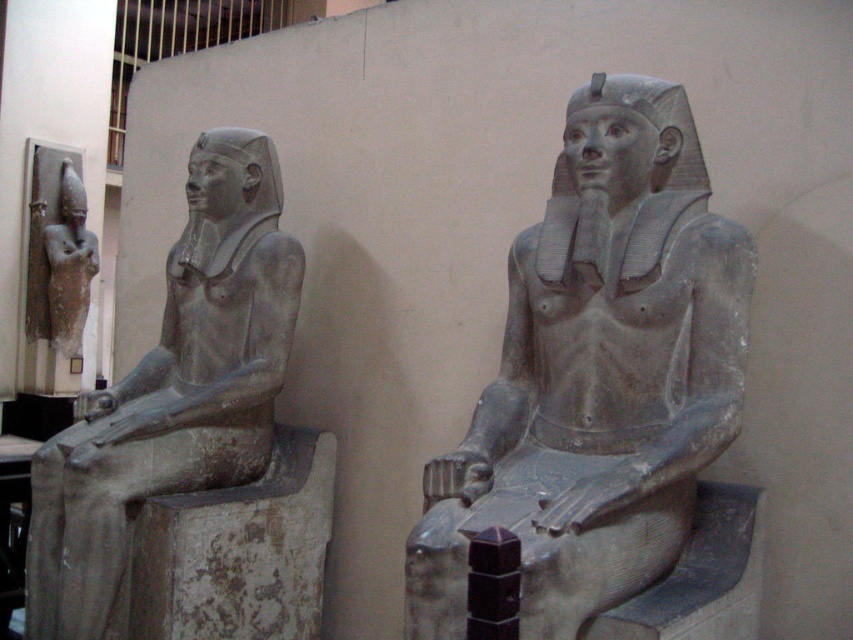
From the picture: Does gray stone statue at center have a greater width compared to gray stone statue at left?

In fact, gray stone statue at center might be narrower than gray stone statue at left.

Is gray stone statue at center further to camera compared to gray stone statue at left?

No, it is in front of gray stone statue at left.

Find the location of `gray stone statue at center`. gray stone statue at center is located at coordinates (596, 376).

Find the location of `gray stone statue at center`. gray stone statue at center is located at coordinates (596, 376).